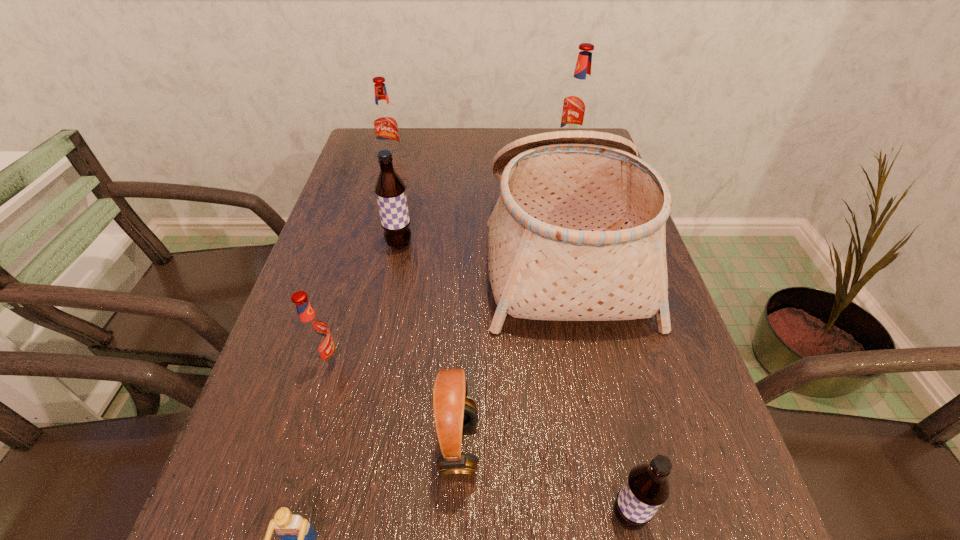
This screenshot has width=960, height=540. Find the location of `vacant space located 0.080m on the ear cups of the sixth farthest object`. vacant space located 0.080m on the ear cups of the sixth farthest object is located at coordinates (529, 447).

The image size is (960, 540). I want to click on basket present at the right edge, so click(578, 233).

Identify the location of object that is at the far left corner. (385, 123).

Identify the location of object situated at the far right corner. This screenshot has height=540, width=960. (578, 99).

The image size is (960, 540). Find the location of `vacant space at the far edge of the desktop`. vacant space at the far edge of the desktop is located at coordinates (466, 163).

At what (x,y) coordinates should I click in order to perform the action: click on vacant space at the left edge. Please return your answer as a coordinate pair (x, y). This screenshot has height=540, width=960. Looking at the image, I should click on (331, 482).

The width and height of the screenshot is (960, 540). I want to click on vacant space at the right edge of the desktop, so click(x=689, y=452).

The width and height of the screenshot is (960, 540). What are the coordinates of `vacant point at the far left corner` in the screenshot? It's located at (357, 147).

Image resolution: width=960 pixels, height=540 pixels. Identify the location of empty location between the third root beer from left to right and the smallest red root beer. (363, 303).

Locate an element on the screen. The height and width of the screenshot is (540, 960). empty location between the basket and the fourth nearest object is located at coordinates (444, 306).